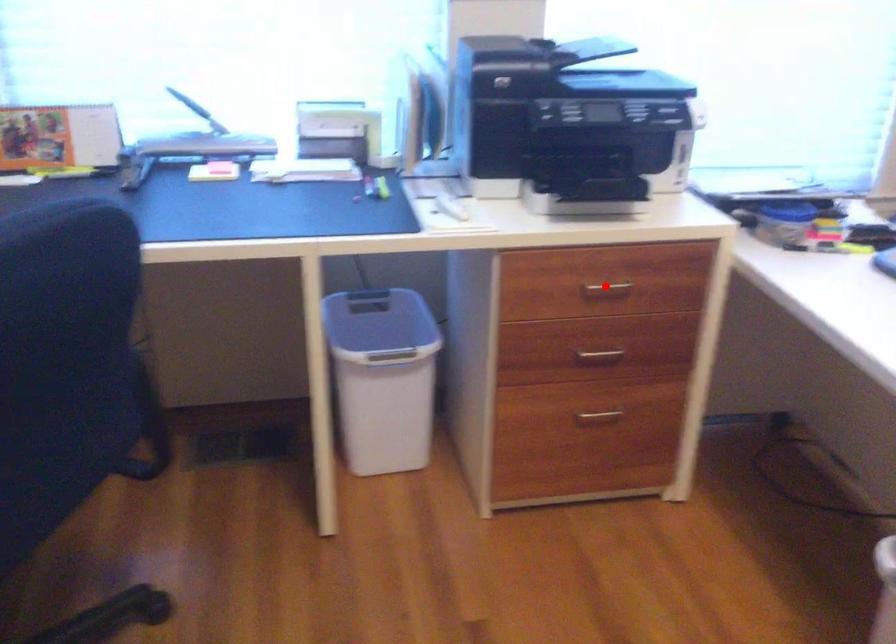
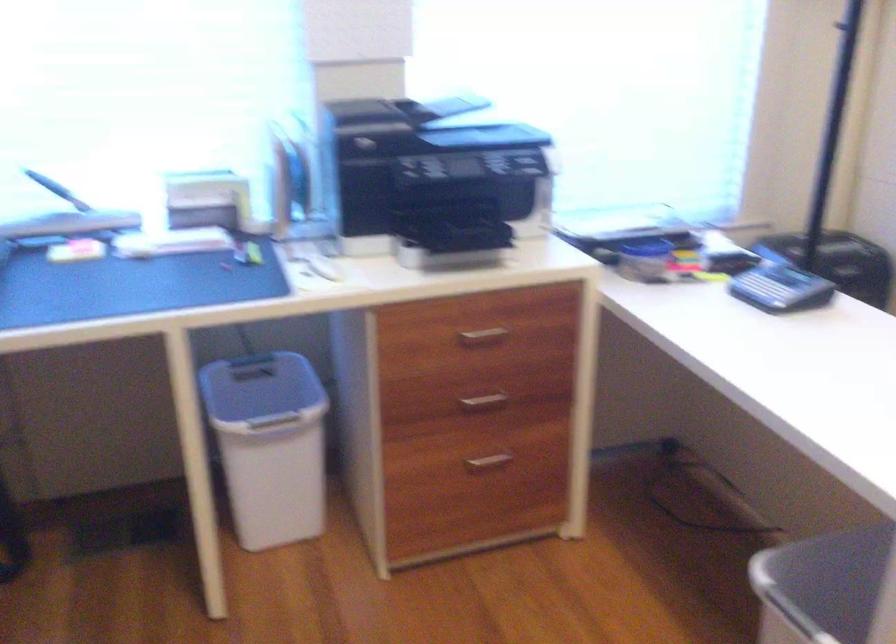
In the second image, find the point that corresponds to the highlighted location in the first image.

(483, 334)